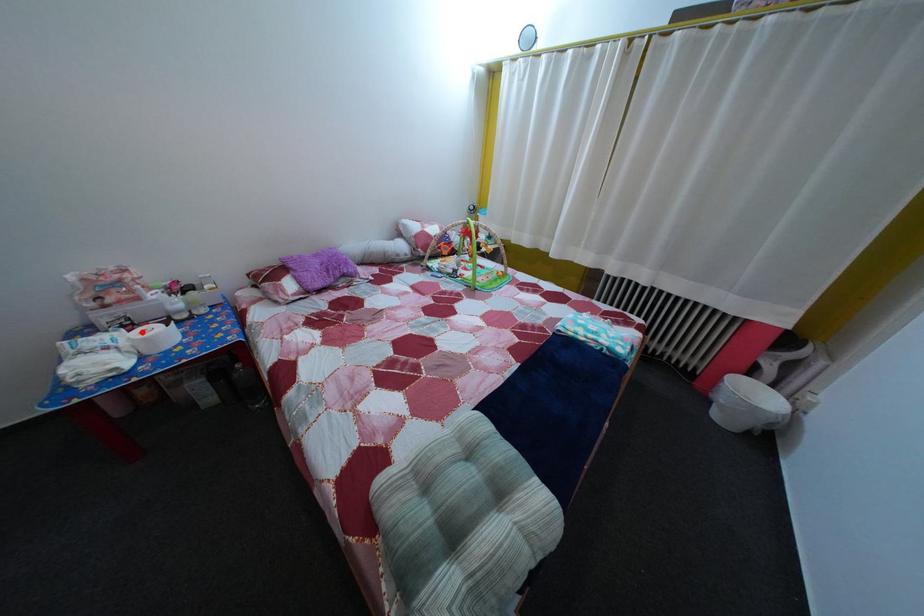
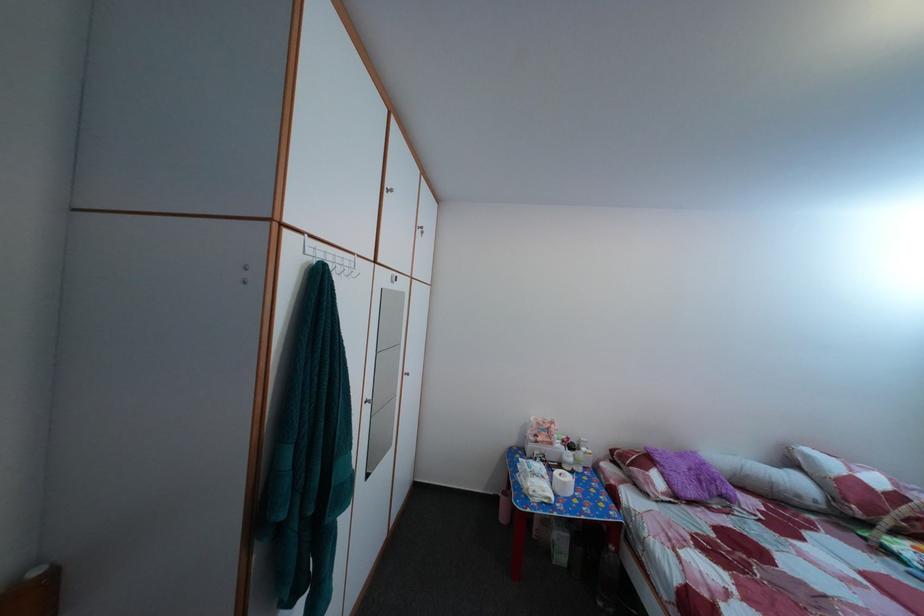
Question: I am providing you with two images of the same scene from different viewpoints. Image1 has a red point marked. In image2, the corresponding 3D location appears at what relative position? Reply with the corresponding letter.

Choices:
 (A) Closer
 (B) Farther

Answer: (B)